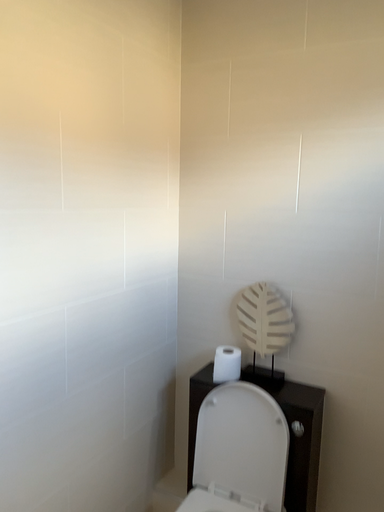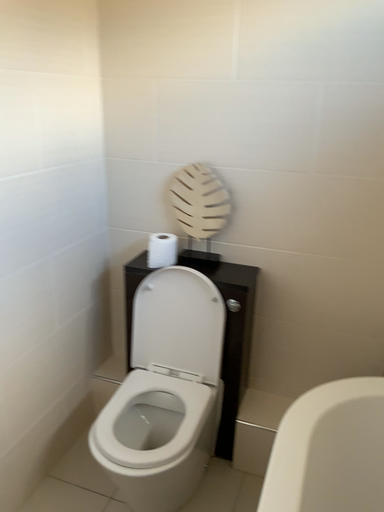
Question: How did the camera likely rotate when shooting the video?

Choices:
 (A) rotated left
 (B) rotated right

Answer: (B)